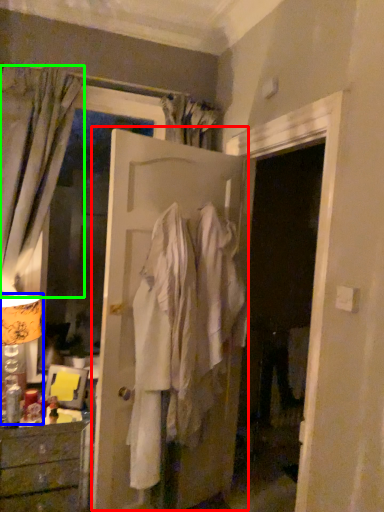
Question: Which object is the farthest from door (highlighted by a red box)? Choose among these: table lamp (highlighted by a blue box) or curtain (highlighted by a green box).

Choices:
 (A) table lamp
 (B) curtain

Answer: (A)